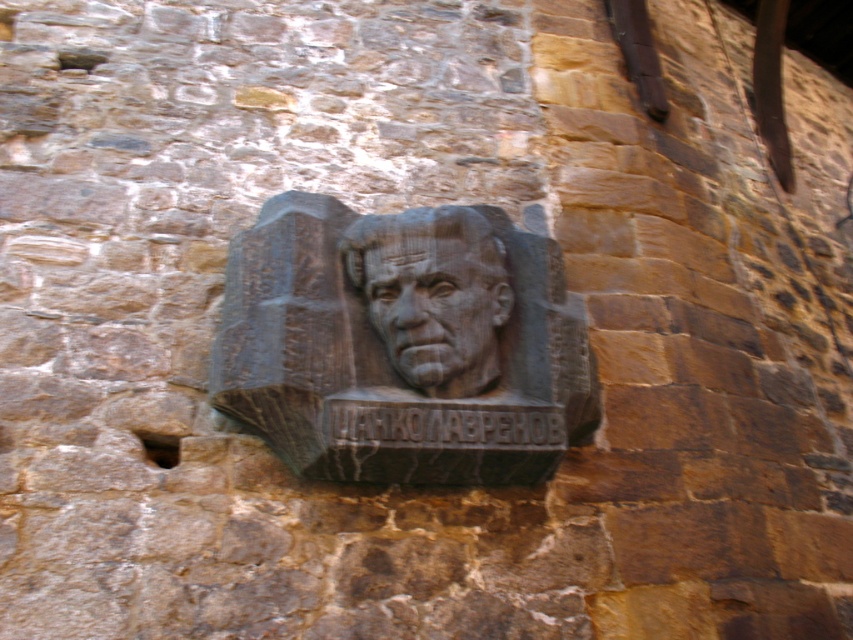
How much distance is there between black stone relief at center and rough stone face at center?

A distance of 12.72 centimeters exists between black stone relief at center and rough stone face at center.

Who is lower down, black stone relief at center or rough stone face at center?

black stone relief at center is below.

What do you see at coordinates (403, 344) in the screenshot?
I see `black stone relief at center` at bounding box center [403, 344].

I want to click on black stone relief at center, so click(x=403, y=344).